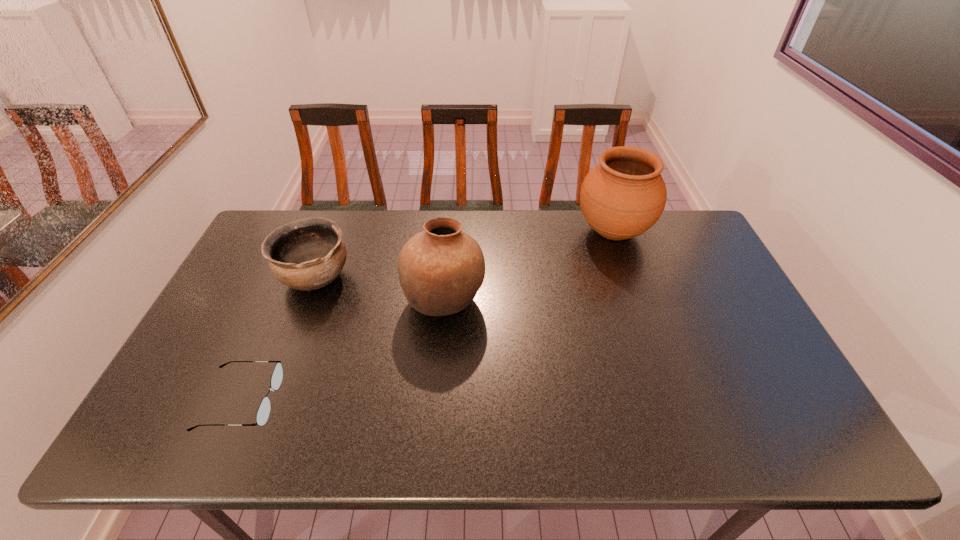
Where is `object at the near edge`? This screenshot has width=960, height=540. object at the near edge is located at coordinates (263, 412).

The width and height of the screenshot is (960, 540). I want to click on pottery positioned at the left edge, so click(307, 254).

Image resolution: width=960 pixels, height=540 pixels. I want to click on spectacles that is at the left edge, so click(x=263, y=412).

I want to click on object that is at the far left corner, so click(x=307, y=254).

Locate an element on the screen. The image size is (960, 540). object that is at the near left corner is located at coordinates (263, 412).

Identify the location of vacant space at the far edge of the desktop. This screenshot has width=960, height=540. 497,252.

You are a GUI agent. You are given a task and a screenshot of the screen. Output one action in this format:
    pyautogui.click(x=<x>, y=<y>)
    Task: Click on the free spot at the near edge of the desktop
    Image resolution: width=960 pixels, height=540 pixels.
    Given the screenshot: What is the action you would take?
    pyautogui.click(x=403, y=453)

The height and width of the screenshot is (540, 960). In the image, there is a desktop. What are the coordinates of `vacant space at the left edge` in the screenshot? It's located at (208, 332).

Locate an element on the screen. Image resolution: width=960 pixels, height=540 pixels. free region at the right edge of the desktop is located at coordinates (780, 370).

In the image, there is a desktop. Where is `vacant space at the far left corner`? The image size is (960, 540). vacant space at the far left corner is located at coordinates [297, 211].